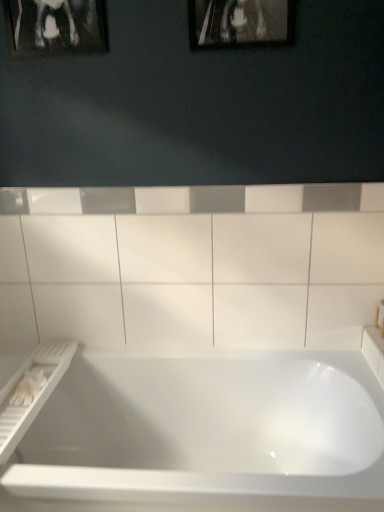
Question: Is metallic silver picture frame at upper center, the 2th picture frame in the left-to-right sequence, wider or thinner than white glossy bathtub at center?

Choices:
 (A) thin
 (B) wide

Answer: (A)

Question: From the image's perspective, is metallic silver picture frame at upper center, the 1th picture frame from the right, positioned above or below white glossy bathtub at center?

Choices:
 (A) below
 (B) above

Answer: (B)

Question: Which is nearer to the white glossy bathtub at center?

Choices:
 (A) white glossy ceramic tile at center
 (B) metallic silver picture frame at upper center, the 2th picture frame in the left-to-right sequence
 (C) black glossy picture frame at upper left, acting as the second picture frame starting from the right

Answer: (A)

Question: Considering the real-world distances, which object is farthest from the white glossy ceramic tile at center?

Choices:
 (A) metallic silver picture frame at upper center, the 1th picture frame from the right
 (B) white glossy bathtub at center
 (C) black glossy picture frame at upper left, acting as the second picture frame starting from the right

Answer: (C)